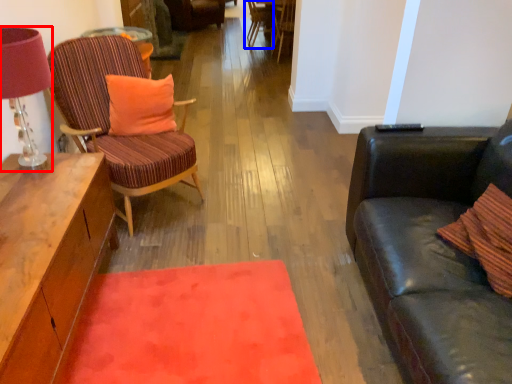
Question: Which point is further to the camera, lamp (highlighted by a red box) or chair (highlighted by a blue box)?

Choices:
 (A) lamp
 (B) chair

Answer: (B)